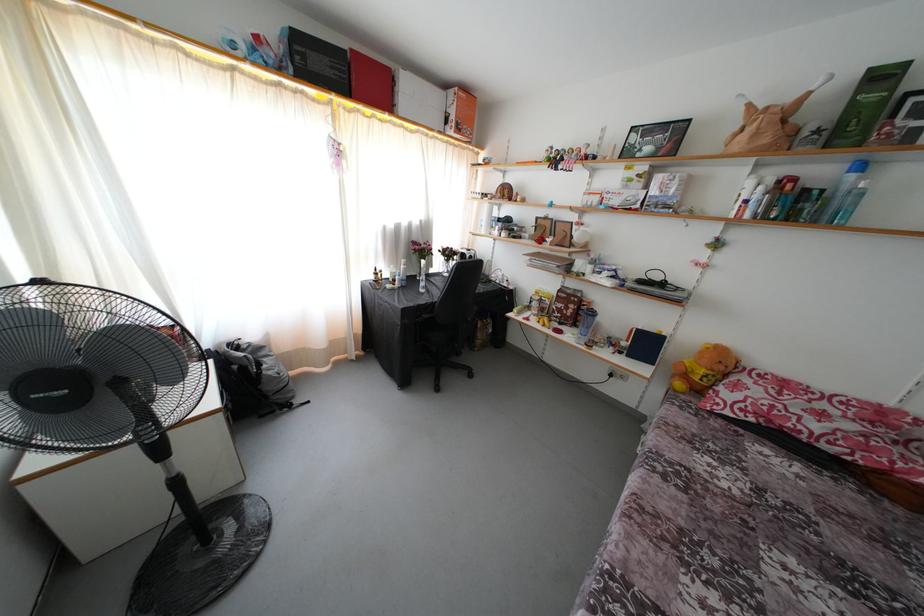
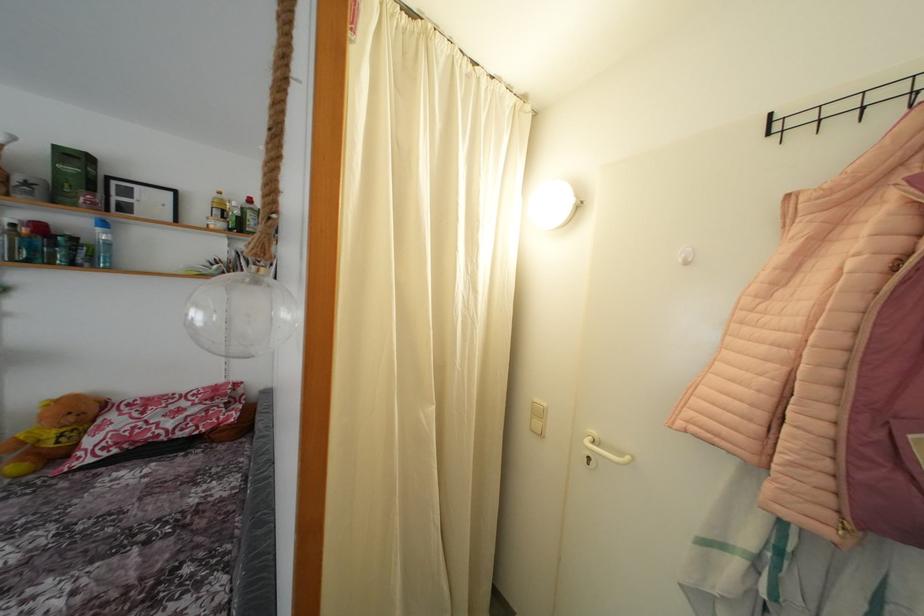
Find the pixel in the second image that matches [726,373] in the first image.

(77, 424)